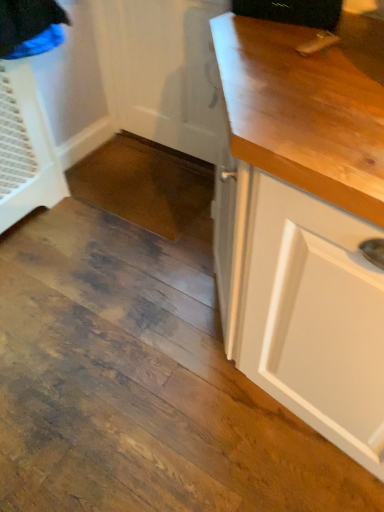
The image size is (384, 512). What do you see at coordinates (25, 148) in the screenshot? I see `white plastic laundry basket at left` at bounding box center [25, 148].

Measure the distance between white plastic laundry basket at left and camera.

The depth of white plastic laundry basket at left is 1.50 meters.

Where is `white plastic laundry basket at left`? white plastic laundry basket at left is located at coordinates (25, 148).

Locate an element on the screen. The width and height of the screenshot is (384, 512). white plastic laundry basket at left is located at coordinates (25, 148).